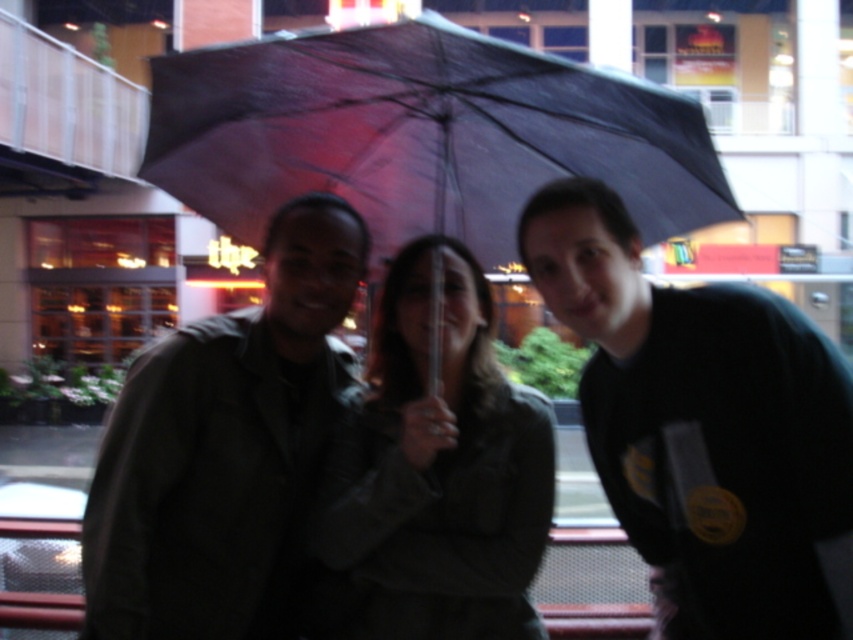
Is matte black umbrella at center thinner than matte black jacket at center?

Incorrect, matte black umbrella at center's width is not less than matte black jacket at center's.

Can you confirm if matte black umbrella at center is positioned above matte black jacket at center?

Correct, matte black umbrella at center is located above matte black jacket at center.

Which is in front, point (637, 476) or point (136, 637)?

Point (136, 637) is in front.

Where is `matte black umbrella at center`? This screenshot has width=853, height=640. matte black umbrella at center is located at coordinates (705, 428).

Does matte black umbrella at center have a lesser height compared to matte green jacket at center?

No, matte black umbrella at center is not shorter than matte green jacket at center.

Which is below, matte black umbrella at center or matte green jacket at center?

Positioned lower is matte green jacket at center.

The width and height of the screenshot is (853, 640). Describe the element at coordinates (705, 428) in the screenshot. I see `matte black umbrella at center` at that location.

The width and height of the screenshot is (853, 640). I want to click on matte black umbrella at center, so click(705, 428).

Is transparent plastic umbrella at center taller than black matte shirt at right?

In fact, transparent plastic umbrella at center may be shorter than black matte shirt at right.

Locate an element on the screen. Image resolution: width=853 pixels, height=640 pixels. transparent plastic umbrella at center is located at coordinates (421, 134).